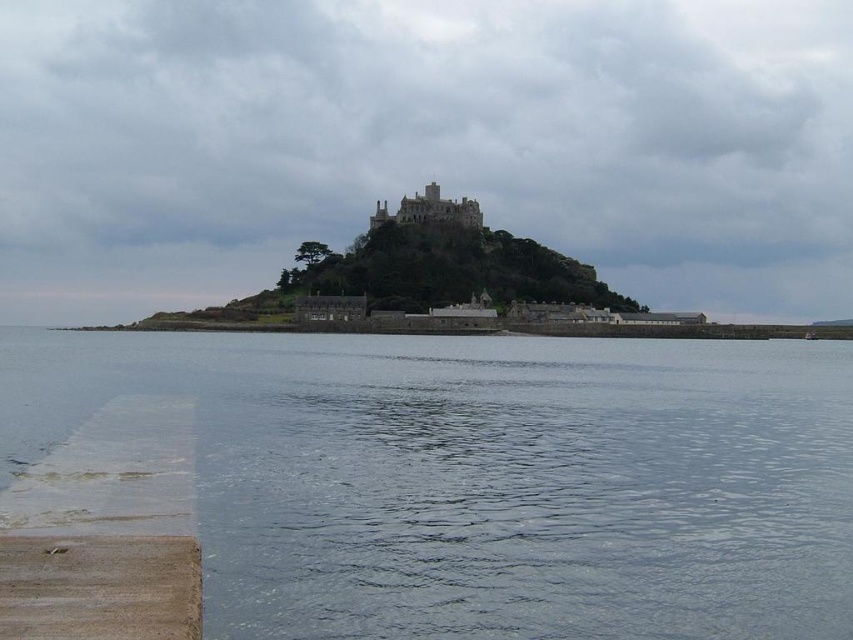
Locate an element on the screen. Image resolution: width=853 pixels, height=640 pixels. clear water at lower left is located at coordinates (486, 477).

Is clear water at lower left taller than stone medieval castle at center?

Indeed, clear water at lower left has a greater height compared to stone medieval castle at center.

Where is `clear water at lower left`? The width and height of the screenshot is (853, 640). clear water at lower left is located at coordinates (486, 477).

The image size is (853, 640). I want to click on brown wooden dock at lower left, so click(106, 531).

Is brown wooden dock at lower left wider than stone medieval castle at center?

No.

Is point (64, 465) closer to viewer compared to point (440, 196)?

That is True.

At what (x,y) coordinates should I click in order to perform the action: click on brown wooden dock at lower left. Please return your answer as a coordinate pair (x, y). The height and width of the screenshot is (640, 853). Looking at the image, I should click on (106, 531).

Is clear water at lower left taller than brown wooden dock at lower left?

Indeed, clear water at lower left has a greater height compared to brown wooden dock at lower left.

Does clear water at lower left have a smaller size compared to brown wooden dock at lower left?

No.

Where is `clear water at lower left`? clear water at lower left is located at coordinates (486, 477).